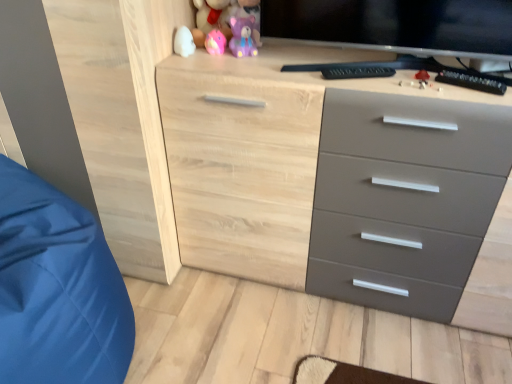
This screenshot has width=512, height=384. I want to click on free point in front of pink rubber duck at upper center, marked as the third toy in a bottom-to-top arrangement, so click(x=221, y=61).